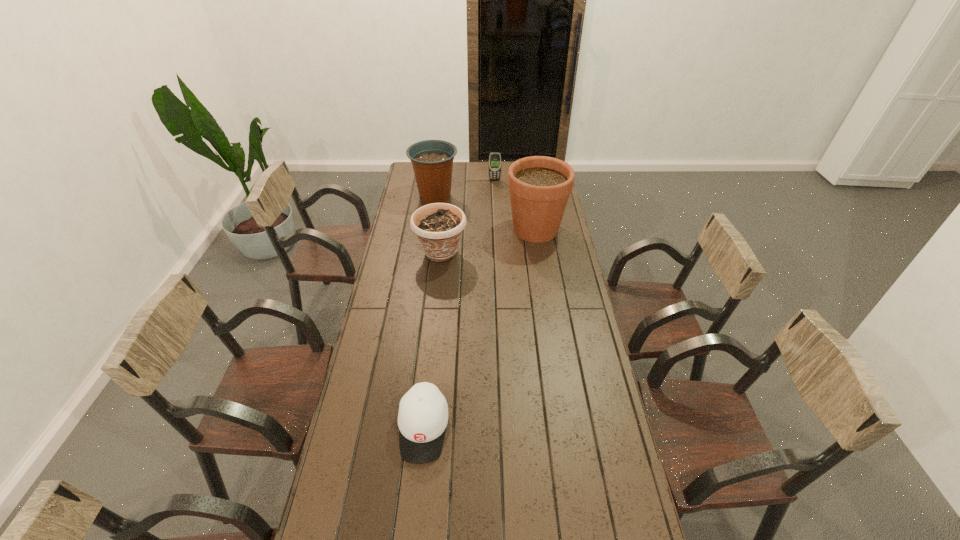
In order to click on unoccupied position between the shortest flowerpot and the farthest object in this screenshot , I will do `click(468, 217)`.

The height and width of the screenshot is (540, 960). Identify the location of free point between the shortest flowerpot and the farthest object. (468, 217).

Find the location of `empty location between the tallest object and the shortest object`. empty location between the tallest object and the shortest object is located at coordinates (479, 329).

Locate which object ranks second in proximity to the rightmost object. Please provide its 2D coordinates. Your answer should be formatted as a tuple, i.e. [(x, y)], where the tuple contains the x and y coordinates of a point satisfying the conditions above.

[(432, 160)]

Where is `the fourth closest object to the nearest object`? The width and height of the screenshot is (960, 540). the fourth closest object to the nearest object is located at coordinates (495, 157).

Identify which flowerpot is located as the nearest to the third tallest object. Please provide its 2D coordinates. Your answer should be formatted as a tuple, i.e. [(x, y)], where the tuple contains the x and y coordinates of a point satisfying the conditions above.

[(539, 186)]

You are a GUI agent. You are given a task and a screenshot of the screen. Output one action in this format:
    pyautogui.click(x=<x>, y=<y>)
    Task: Click on the flowerpot that stands as the closest to the rightmost object
    
    Given the screenshot: What is the action you would take?
    [438, 226]

At what (x,y) coordinates should I click in order to perform the action: click on vacant point that satisfies the following two spatial constraints: 1. on the back side of the tallest flowerpot; 2. on the right side of the shortest flowerpot. Please return your answer as a coordinate pair (x, y). Looking at the image, I should click on (444, 230).